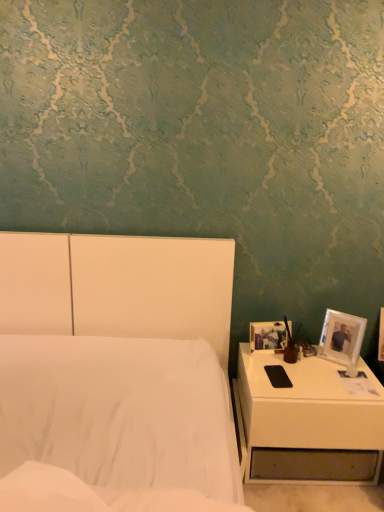
I want to click on matte brown vase at right, so click(291, 345).

Describe the element at coordinates (341, 337) in the screenshot. I see `white plastic picture frame at right, which is the second picture frame from left to right` at that location.

The width and height of the screenshot is (384, 512). I want to click on white glossy nightstand at lower right, so click(x=310, y=421).

In order to click on matte brown vase at right in this screenshot , I will do `click(291, 345)`.

Can you confirm if white matte bed at center is taller than matte brown vase at right?

Correct, white matte bed at center is much taller as matte brown vase at right.

Considering the sizes of objects white matte bed at center and matte brown vase at right in the image provided, who is thinner, white matte bed at center or matte brown vase at right?

With smaller width is matte brown vase at right.

Would you say white matte bed at center is outside matte brown vase at right?

Absolutely, white matte bed at center is external to matte brown vase at right.

Consider the image. Can you confirm if white matte bed at center is wider than white glossy nightstand at lower right?

Yes, white matte bed at center is wider than white glossy nightstand at lower right.

The width and height of the screenshot is (384, 512). I want to click on bed above the white glossy nightstand at lower right (from the image's perspective), so click(x=116, y=374).

Is white glossy nightstand at lower right at the back of white matte bed at center?

white matte bed at center does not have its back to white glossy nightstand at lower right.

From the image's perspective, which object appears higher, white matte bed at center or white glossy nightstand at lower right?

white matte bed at center is shown above in the image.

From the image's perspective, is matte brown vase at right on white plastic picture frame at right, the first picture frame from the right?

Yes, from the image's perspective, matte brown vase at right is on top of white plastic picture frame at right, the first picture frame from the right.

Is white plastic picture frame at right, which is the second picture frame from left to right, a part of matte brown vase at right?

Actually, white plastic picture frame at right, which is the second picture frame from left to right, is outside matte brown vase at right.

From a real-world perspective, is matte brown vase at right positioned above or below white plastic picture frame at right, the first picture frame from the right?

matte brown vase at right is above white plastic picture frame at right, the first picture frame from the right.

Is matte brown vase at right smaller than white plastic picture frame at right, which is the second picture frame from left to right?

Yes, matte brown vase at right is smaller than white plastic picture frame at right, which is the second picture frame from left to right.

Is matte plastic picture frame at right, which is the 2th picture frame from right to left, facing away from white glossy nightstand at lower right?

No.

From the image's perspective, who appears lower, matte plastic picture frame at right, which is the 2th picture frame from right to left, or white glossy nightstand at lower right?

white glossy nightstand at lower right is shown below in the image.

From their relative heights in the image, would you say matte plastic picture frame at right, which is the 2th picture frame from right to left, is taller or shorter than white glossy nightstand at lower right?

Clearly, matte plastic picture frame at right, which is the 2th picture frame from right to left, is shorter compared to white glossy nightstand at lower right.

Based on the photo, are matte plastic picture frame at right, the 1th picture frame from the left, and white glossy nightstand at lower right located far from each other?

matte plastic picture frame at right, the 1th picture frame from the left, is near white glossy nightstand at lower right, not far away.

Which point is more forward, (271, 331) or (181, 381)?

The point (181, 381) is in front.

From the picture: Can you confirm if matte plastic picture frame at right, which is the 2th picture frame from right to left, is smaller than white matte bed at center?

Correct, matte plastic picture frame at right, which is the 2th picture frame from right to left, occupies less space than white matte bed at center.

Which of these two, matte plastic picture frame at right, the 1th picture frame from the left, or white matte bed at center, is thinner?

matte plastic picture frame at right, the 1th picture frame from the left, is thinner.

Where is `bed below the matte plastic picture frame at right, the 1th picture frame from the left (from a real-world perspective)`? The height and width of the screenshot is (512, 384). bed below the matte plastic picture frame at right, the 1th picture frame from the left (from a real-world perspective) is located at coordinates (116, 374).

Where is `picture frame lying in front of the matte plastic picture frame at right, which is the 2th picture frame from right to left`? This screenshot has height=512, width=384. picture frame lying in front of the matte plastic picture frame at right, which is the 2th picture frame from right to left is located at coordinates [341, 337].

Considering the positions of points (275, 333) and (337, 336), is point (275, 333) farther from camera compared to point (337, 336)?

Yes, point (275, 333) is behind point (337, 336).

Is matte plastic picture frame at right, which is the 2th picture frame from right to left, located outside white plastic picture frame at right, the first picture frame from the right?

Yes.

From a real-world perspective, is matte plastic picture frame at right, which is the 2th picture frame from right to left, over white plastic picture frame at right, the first picture frame from the right?

Incorrect, from a real-world perspective, matte plastic picture frame at right, which is the 2th picture frame from right to left, is lower than white plastic picture frame at right, the first picture frame from the right.

Looking at this image, from the image's perspective, would you say white plastic picture frame at right, which is the second picture frame from left to right, is shown under white glossy nightstand at lower right?

Actually, white plastic picture frame at right, which is the second picture frame from left to right, appears above white glossy nightstand at lower right in the image.

From a real-world perspective, starting from the white glossy nightstand at lower right, which picture frame is the 2nd one vertically above it? Please provide its 2D coordinates.

[(341, 337)]

Does white plastic picture frame at right, the first picture frame from the right, have a larger size compared to white glossy nightstand at lower right?

No, white plastic picture frame at right, the first picture frame from the right, is not bigger than white glossy nightstand at lower right.

In the scene shown: Is white plastic picture frame at right, which is the second picture frame from left to right, at the right side of white glossy nightstand at lower right?

Indeed, white plastic picture frame at right, which is the second picture frame from left to right, is positioned on the right side of white glossy nightstand at lower right.

Locate an element on the screen. bedside lamp behind the white matte bed at center is located at coordinates (291, 345).

In the image, there is a white matte bed at center. At what (x,y) coordinates should I click in order to perform the action: click on nightstand below it (from the image's perspective). Please return your answer as a coordinate pair (x, y). Looking at the image, I should click on (310, 421).

Looking at the image, which one is located further to white glossy nightstand at lower right, white matte bed at center or matte plastic picture frame at right, the 1th picture frame from the left?

Among the two, white matte bed at center is located further to white glossy nightstand at lower right.

When comparing their distances from white matte bed at center, does white plastic picture frame at right, which is the second picture frame from left to right, or matte plastic picture frame at right, which is the 2th picture frame from right to left, seem further?

white plastic picture frame at right, which is the second picture frame from left to right, is further to white matte bed at center.

From the image, which object appears to be farther from matte plastic picture frame at right, which is the 2th picture frame from right to left, white matte bed at center or matte brown vase at right?

white matte bed at center is positioned further to the anchor matte plastic picture frame at right, which is the 2th picture frame from right to left.

When comparing their distances from white matte bed at center, does white glossy nightstand at lower right or matte brown vase at right seem further?

Based on the image, matte brown vase at right appears to be further to white matte bed at center.

Based on their spatial positions, is white plastic picture frame at right, the first picture frame from the right, or matte plastic picture frame at right, the 1th picture frame from the left, further from white glossy nightstand at lower right?

matte plastic picture frame at right, the 1th picture frame from the left.

Based on the photo, when comparing their distances from matte brown vase at right, does matte plastic picture frame at right, the 1th picture frame from the left, or white plastic picture frame at right, which is the second picture frame from left to right, seem further?

Among the two, white plastic picture frame at right, which is the second picture frame from left to right, is located further to matte brown vase at right.

When comparing their distances from matte brown vase at right, does white glossy nightstand at lower right or white plastic picture frame at right, which is the second picture frame from left to right, seem closer?

The object closer to matte brown vase at right is white plastic picture frame at right, which is the second picture frame from left to right.

Based on their spatial positions, is white plastic picture frame at right, which is the second picture frame from left to right, or matte plastic picture frame at right, the 1th picture frame from the left, closer to matte brown vase at right?

matte plastic picture frame at right, the 1th picture frame from the left, is closer to matte brown vase at right.

Locate an element on the screen. This screenshot has height=512, width=384. picture frame located between white matte bed at center and matte brown vase at right in the depth direction is located at coordinates (341, 337).

What are the coordinates of `bedside lamp positioned between white matte bed at center and matte plastic picture frame at right, which is the 2th picture frame from right to left, from near to far` in the screenshot? It's located at (291, 345).

Where is `picture frame between white plastic picture frame at right, which is the second picture frame from left to right, and white glossy nightstand at lower right in the up-down direction`? picture frame between white plastic picture frame at right, which is the second picture frame from left to right, and white glossy nightstand at lower right in the up-down direction is located at coordinates (268, 336).

The image size is (384, 512). Find the location of `nightstand between white matte bed at center and matte brown vase at right in the front-back direction`. nightstand between white matte bed at center and matte brown vase at right in the front-back direction is located at coordinates (310, 421).